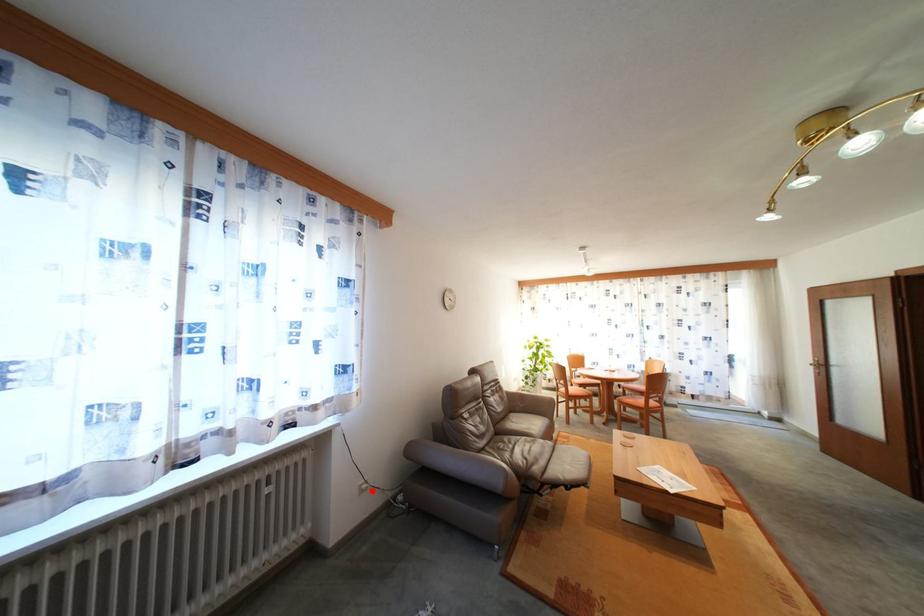
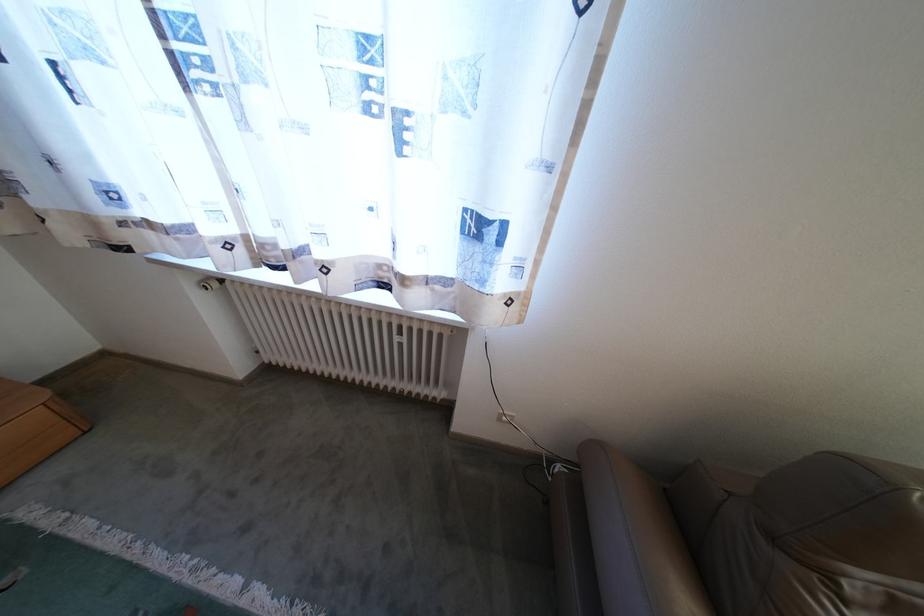
Question: I am providing you with two images of the same scene from different viewpoints. A red point is marked on the first image. Can you still see the location of the red point in image 2?

Choices:
 (A) Yes
 (B) No

Answer: (A)